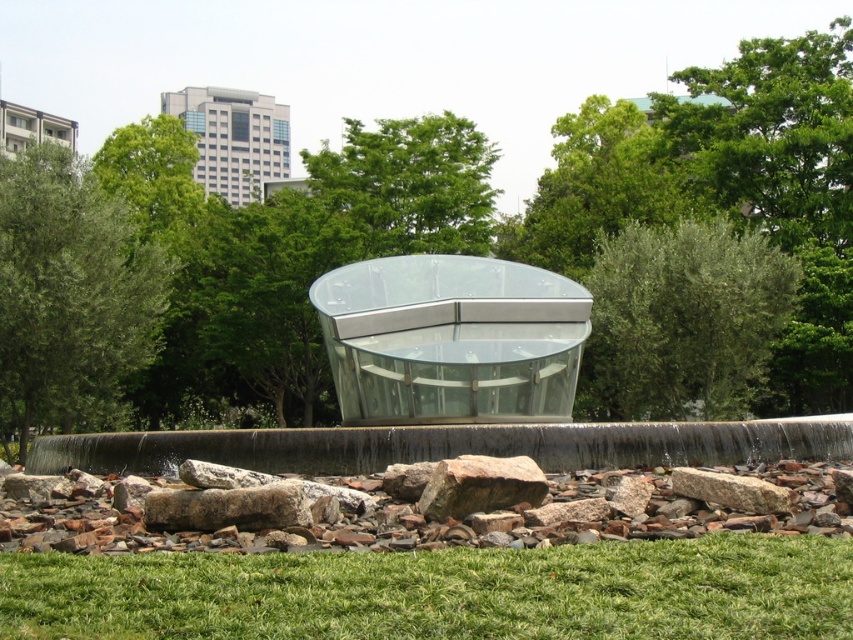
Question: Which point is closer to the camera?

Choices:
 (A) green grass at lower center
 (B) green leafy tree at upper center

Answer: (A)

Question: In this image, where is green leafy tree at center located relative to brown rough rock at lower center?

Choices:
 (A) left
 (B) right

Answer: (B)

Question: Which object appears farthest from the camera in this image?

Choices:
 (A) green grass at lower center
 (B) green leafy tree at left
 (C) brown rough rock at lower center
 (D) green leafy tree at center

Answer: (D)

Question: Can you confirm if green leafy tree at center is smaller than brown rough rock at lower center?

Choices:
 (A) no
 (B) yes

Answer: (A)

Question: Where is transparent glass bench at center located in relation to green leafy tree at center in the image?

Choices:
 (A) below
 (B) above

Answer: (B)

Question: Among these points, which one is farthest from the camera?

Choices:
 (A) (428, 412)
 (B) (624, 408)

Answer: (B)